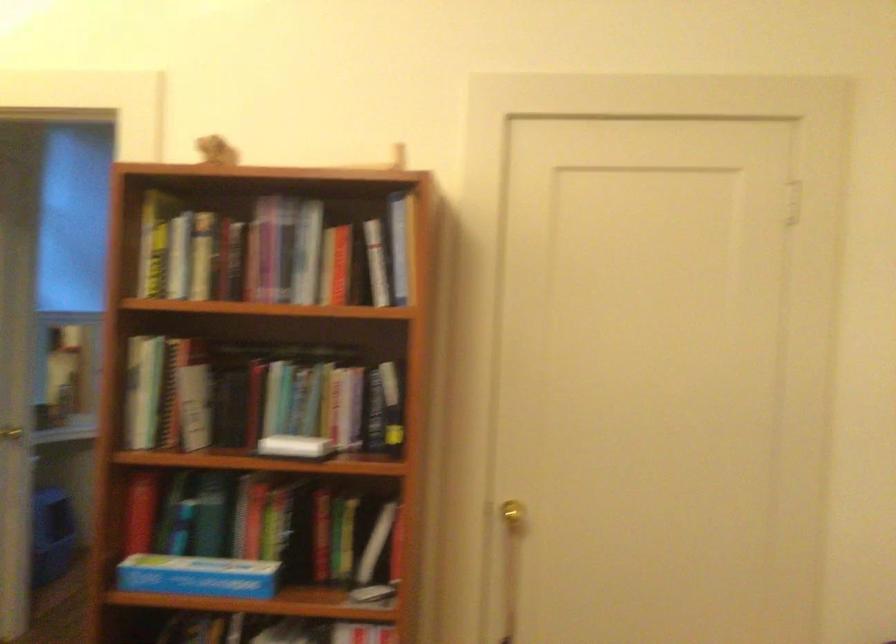
You are a GUI agent. You are given a task and a screenshot of the screen. Output one action in this format:
    pyautogui.click(x=<x>, y=<y>)
    Task: Click on the blue cardboard box
    
    Given the screenshot: What is the action you would take?
    pyautogui.click(x=197, y=576)